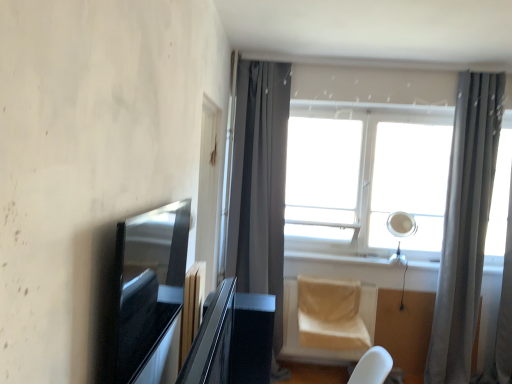
The height and width of the screenshot is (384, 512). In order to click on white glass window at center in this screenshot , I will do `click(366, 176)`.

You are a GUI agent. You are given a task and a screenshot of the screen. Output one action in this format:
    pyautogui.click(x=<x>, y=<y>)
    Task: Click on the beige fabric swivel chair at lower center
    This screenshot has height=384, width=512.
    Given the screenshot: What is the action you would take?
    pyautogui.click(x=331, y=315)

Which is closer, (x=313, y=224) or (x=308, y=336)?

The point (x=308, y=336) is more forward.

Consider the image. Does white glass window at center turn towards beige fabric swivel chair at lower center?

No.

From the picture: Can you see white glass window at center touching beige fabric swivel chair at lower center?

No, white glass window at center is not with beige fabric swivel chair at lower center.

Considering the relative positions of white glass window at center and beige fabric swivel chair at lower center in the image provided, is white glass window at center to the left of beige fabric swivel chair at lower center from the viewer's perspective?

Incorrect, white glass window at center is not on the left side of beige fabric swivel chair at lower center.

Considering the points (443, 185) and (484, 150), which point is in front, point (443, 185) or point (484, 150)?

The point (484, 150) is more forward.

From a real-world perspective, is white glass window at center physically below gray sheer curtain at right, the 1th curtain viewed from the right?

Incorrect, from a real-world perspective, white glass window at center is higher than gray sheer curtain at right, the 1th curtain viewed from the right.

How distant is white glass window at center from gray sheer curtain at right, the 1th curtain viewed from the right?

white glass window at center and gray sheer curtain at right, the 1th curtain viewed from the right, are 23.34 inches apart.

Is white glass window at center in front of or behind gray sheer curtain at right, the 1th curtain viewed from the right, in the image?

In the image, white glass window at center appears behind gray sheer curtain at right, the 1th curtain viewed from the right.

Is beige fabric swivel chair at lower center wider or thinner than white glass window at center?

beige fabric swivel chair at lower center is wider than white glass window at center.

Would you say beige fabric swivel chair at lower center is inside or outside white glass window at center?

beige fabric swivel chair at lower center is not inside white glass window at center, it's outside.

Can you see beige fabric swivel chair at lower center touching white glass window at center?

No, beige fabric swivel chair at lower center is not touching white glass window at center.

In the scene shown: Considering the sizes of beige fabric swivel chair at lower center and gray sheer curtain at right, the 1th curtain viewed from the right, in the image, is beige fabric swivel chair at lower center taller or shorter than gray sheer curtain at right, the 1th curtain viewed from the right,?

beige fabric swivel chair at lower center is shorter than gray sheer curtain at right, the 1th curtain viewed from the right.

Is beige fabric swivel chair at lower center not near gray sheer curtain at right, the 1th curtain viewed from the right?

beige fabric swivel chair at lower center is actually quite close to gray sheer curtain at right, the 1th curtain viewed from the right.

From the image's perspective, which object appears higher, beige fabric swivel chair at lower center or gray sheer curtain at right, which is counted as the 2th curtain, starting from the left?

gray sheer curtain at right, which is counted as the 2th curtain, starting from the left, appears higher in the image.

Would you say beige fabric swivel chair at lower center contains gray sheer curtain at right, the 1th curtain viewed from the right?

Actually, gray sheer curtain at right, the 1th curtain viewed from the right, is outside beige fabric swivel chair at lower center.

Which is in front, point (490, 176) or point (246, 229)?

The point (490, 176) is closer.

Between gray sheer curtain at right, which is counted as the 2th curtain, starting from the left, and dark gray fabric curtain at center, the 1th curtain viewed from the left, which one is positioned in front?

dark gray fabric curtain at center, the 1th curtain viewed from the left, is more forward.

Is dark gray fabric curtain at center, the second curtain when ordered from right to left, at the back of gray sheer curtain at right, which is counted as the 2th curtain, starting from the left?

gray sheer curtain at right, which is counted as the 2th curtain, starting from the left, does not have its back to dark gray fabric curtain at center, the second curtain when ordered from right to left.

From a real-world perspective, is gray sheer curtain at right, the 1th curtain viewed from the right, below dark gray fabric curtain at center, the second curtain when ordered from right to left?

Yes.

How many degrees apart are the facing directions of glossy black table at center and white plastic window sill at center?

89.9 degrees.

Does point (255, 383) come closer to viewer compared to point (312, 255)?

Yes, point (255, 383) is in front of point (312, 255).

Relative to white plastic window sill at center, is glossy black table at center in front or behind?

glossy black table at center is in front of white plastic window sill at center.

Is glossy black table at center taller than white plastic window sill at center?

Yes, glossy black table at center is taller than white plastic window sill at center.

Can you confirm if gray sheer curtain at right, which is counted as the 2th curtain, starting from the left, is wider than white glass window at center?

Correct, the width of gray sheer curtain at right, which is counted as the 2th curtain, starting from the left, exceeds that of white glass window at center.

Are gray sheer curtain at right, which is counted as the 2th curtain, starting from the left, and white glass window at center making contact?

No, gray sheer curtain at right, which is counted as the 2th curtain, starting from the left, is not making contact with white glass window at center.

Is gray sheer curtain at right, which is counted as the 2th curtain, starting from the left, facing towards white glass window at center?

No, gray sheer curtain at right, which is counted as the 2th curtain, starting from the left, does not turn towards white glass window at center.

Locate an element on the screen. This screenshot has width=512, height=384. window on the left of gray sheer curtain at right, which is counted as the 2th curtain, starting from the left is located at coordinates (366, 176).

Where is `window on the right of beige fabric swivel chair at lower center`? window on the right of beige fabric swivel chair at lower center is located at coordinates (x=366, y=176).

From a real-world perspective, starting from the white glass window at center, which curtain is the 2nd one below it? Please provide its 2D coordinates.

[(465, 225)]

Which object lies nearer to the anchor point white glass window at center, gray sheer curtain at right, the 1th curtain viewed from the right, or dark gray fabric curtain at center, the second curtain when ordered from right to left?

Based on the image, gray sheer curtain at right, the 1th curtain viewed from the right, appears to be nearer to white glass window at center.

Considering their positions, is glossy black table at center positioned further to gray sheer curtain at right, which is counted as the 2th curtain, starting from the left, than white glass window at center?

Based on the image, glossy black table at center appears to be further to gray sheer curtain at right, which is counted as the 2th curtain, starting from the left.

Considering their positions, is dark gray fabric curtain at center, the second curtain when ordered from right to left, positioned closer to beige fabric swivel chair at lower center than gray sheer curtain at right, the 1th curtain viewed from the right?

dark gray fabric curtain at center, the second curtain when ordered from right to left, lies closer to beige fabric swivel chair at lower center than the other object.

Looking at the image, which one is located closer to white plastic window sill at center, glossy black table at center or beige fabric swivel chair at lower center?

Among the two, beige fabric swivel chair at lower center is located nearer to white plastic window sill at center.

Considering their positions, is dark gray fabric curtain at center, the 1th curtain viewed from the left, positioned further to glossy black table at center than gray sheer curtain at right, the 1th curtain viewed from the right?

gray sheer curtain at right, the 1th curtain viewed from the right, is positioned further to the anchor glossy black table at center.

Considering their positions, is white glass window at center positioned further to dark gray fabric curtain at center, the 1th curtain viewed from the left, than gray sheer curtain at right, the 1th curtain viewed from the right?

gray sheer curtain at right, the 1th curtain viewed from the right, is positioned further to the anchor dark gray fabric curtain at center, the 1th curtain viewed from the left.

Looking at the image, which one is located further to dark gray fabric curtain at center, the second curtain when ordered from right to left, glossy black table at center or white plastic window sill at center?

glossy black table at center.

Looking at the image, which one is located closer to white glass window at center, white plastic window sill at center or gray sheer curtain at right, which is counted as the 2th curtain, starting from the left?

The object closer to white glass window at center is gray sheer curtain at right, which is counted as the 2th curtain, starting from the left.

Image resolution: width=512 pixels, height=384 pixels. Find the location of `curtain located between glossy black table at center and gray sheer curtain at right, the 1th curtain viewed from the right, in the left-right direction`. curtain located between glossy black table at center and gray sheer curtain at right, the 1th curtain viewed from the right, in the left-right direction is located at coordinates (260, 187).

You are a GUI agent. You are given a task and a screenshot of the screen. Output one action in this format:
    pyautogui.click(x=<x>, y=<y>)
    Task: Click on the window sill between dark gray fabric curtain at center, the second curtain when ordered from right to left, and white glass window at center from left to right
    The width and height of the screenshot is (512, 384).
    Given the screenshot: What is the action you would take?
    (358, 259)

Find the location of `window between glossy black table at center and gray sheer curtain at right, which is counted as the 2th curtain, starting from the left`. window between glossy black table at center and gray sheer curtain at right, which is counted as the 2th curtain, starting from the left is located at coordinates (366, 176).

Locate an element on the screen. The image size is (512, 384). swivel chair located between glossy black table at center and white plastic window sill at center in the depth direction is located at coordinates pyautogui.click(x=331, y=315).